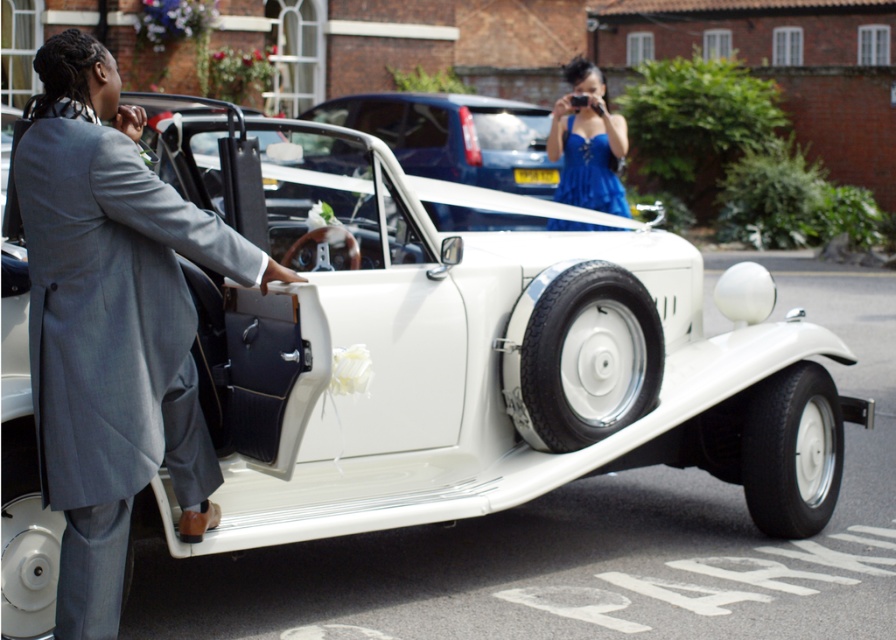
Is point (112, 381) in front of point (596, 122)?

Yes, it is.

Does point (195, 323) come farther from viewer compared to point (571, 125)?

No, (195, 323) is closer to viewer.

You are a GUI agent. You are given a task and a screenshot of the screen. Output one action in this format:
    pyautogui.click(x=<x>, y=<y>)
    Task: Click on the gray wool suit at left
    
    Given the screenshot: What is the action you would take?
    pyautogui.click(x=105, y=349)

Where is `gray wool suit at left`? The image size is (896, 640). gray wool suit at left is located at coordinates (105, 349).